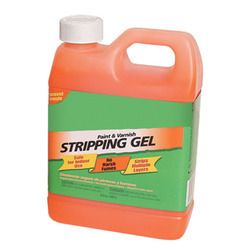
Identify the location of handle. The height and width of the screenshot is (250, 250). (146, 36).